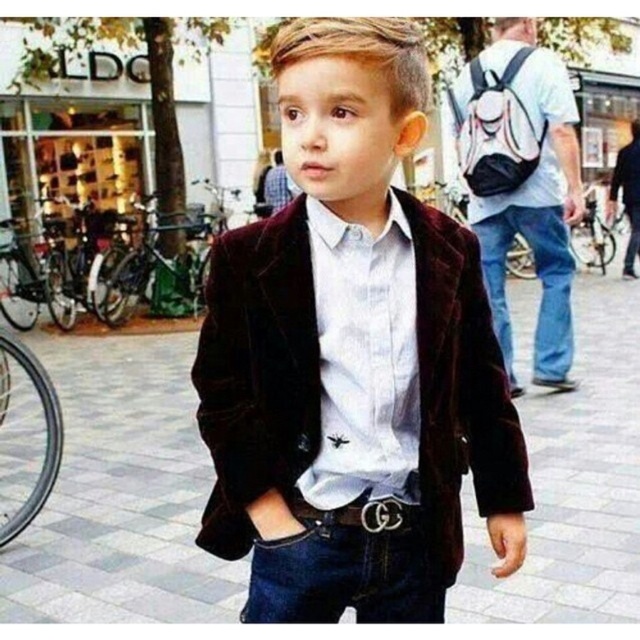
Question: Is white satin shirt at center positioned behind denim jeans at center?

Choices:
 (A) yes
 (B) no

Answer: (B)

Question: Which point is farther to the camera?

Choices:
 (A) (520, 449)
 (B) (388, 385)

Answer: (A)

Question: Considering the relative positions of white satin shirt at center and blue denim jeans at right in the image provided, where is white satin shirt at center located with respect to blue denim jeans at right?

Choices:
 (A) below
 (B) above

Answer: (A)

Question: Among these points, which one is nearest to the camera?

Choices:
 (A) (508, 355)
 (B) (337, 600)
 (C) (339, 522)

Answer: (C)

Question: Does velvet brown blazer at center appear under white satin shirt at center?

Choices:
 (A) yes
 (B) no

Answer: (A)

Question: Based on their relative distances, which object is farther from the denim jeans at center?

Choices:
 (A) black leather belt at center
 (B) dark gray concrete pavement at center
 (C) white satin shirt at center

Answer: (B)